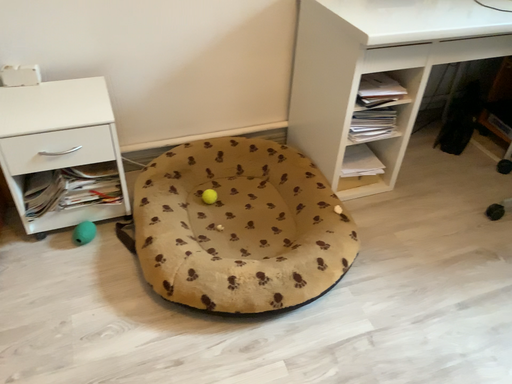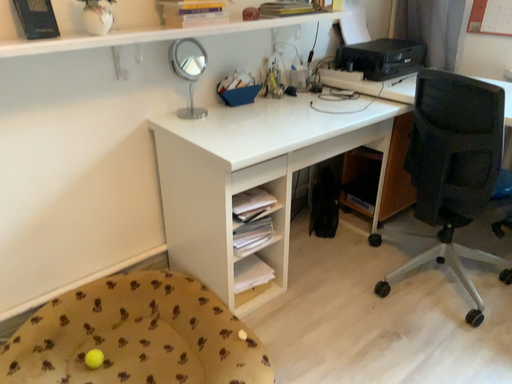
Question: Which way did the camera rotate in the video?

Choices:
 (A) rotated downward
 (B) rotated upward

Answer: (B)